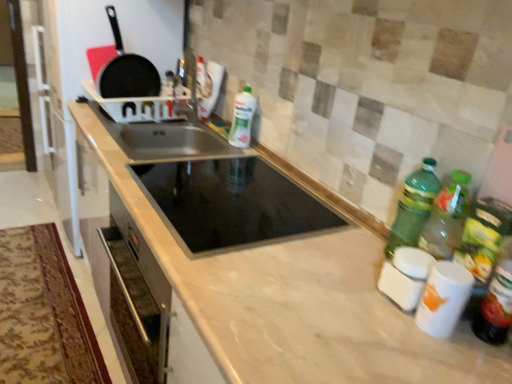
You are a GUI agent. You are given a task and a screenshot of the screen. Output one action in this format:
    pyautogui.click(x=<x>, y=<y>)
    Task: Click on the vacant space positioned to the left of green plastic bottle at right, which appears as the 1th bottle when ordered from the bottom
    Image resolution: width=512 pixels, height=384 pixels.
    Given the screenshot: What is the action you would take?
    pyautogui.click(x=402, y=327)